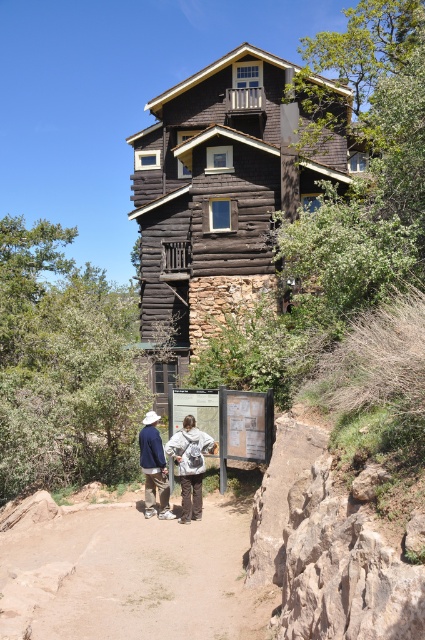
You are a visitor at the cabin and want to take a photo of the dark brown wood log cabin at center and the khaki cotton pants at center together. Which object should you focus on first to ensure both are in frame?

You should focus on the dark brown wood log cabin at center first because it is taller than the khaki cotton pants at center, so adjusting the camera angle to include its full height will naturally include the smaller khaki cotton pants at center in the frame.

You are a photographer planning to take a wide shot of the dark brown wood log cabin at center and the khaki cotton pants at center. Given that your camera can capture a maximum width of 10 meters, can you fit both subjects into the frame without zooming?

The dark brown wood log cabin at center is wider than the khaki cotton pants at center. However, since the camera can capture up to 10 meters, and the cabin alone may already exceed this width, it might not be possible to fit both subjects into the frame without zooming.

You are standing at the point with coordinates (217, 198) in the image of the rustic wooden cabin. What structure are you directly facing?

The point at coordinates (217, 198) directly faces the dark brown wood log cabin at center.